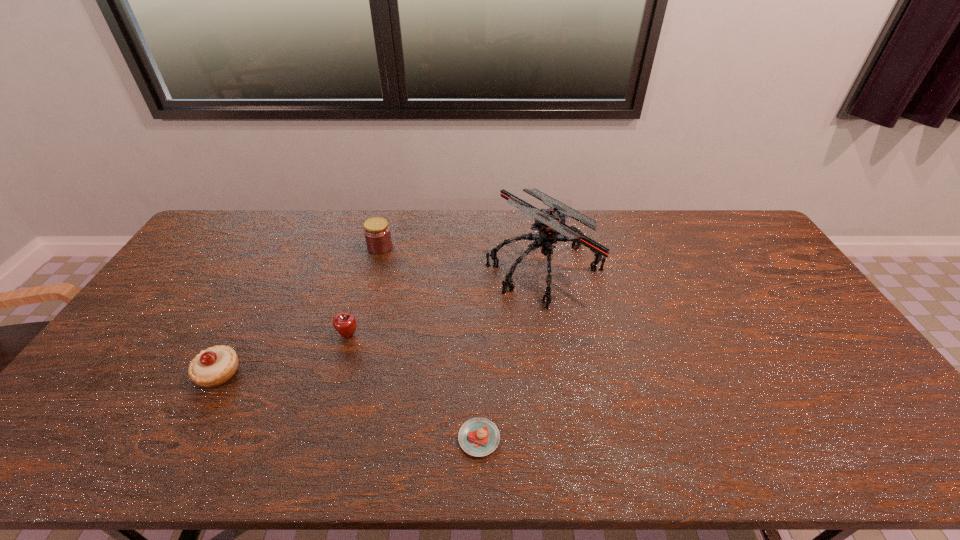
Find the location of a particular element. Image resolution: width=960 pixels, height=540 pixels. free region located on the right of the third nearest object is located at coordinates (418, 335).

Identify the location of vacant area situated on the left of the right pastry. This screenshot has height=540, width=960. (356, 438).

You are a GUI agent. You are given a task and a screenshot of the screen. Output one action in this format:
    pyautogui.click(x=<x>, y=<y>)
    Task: Click on the drone positioned at the far edge
    The width and height of the screenshot is (960, 540).
    Given the screenshot: What is the action you would take?
    pyautogui.click(x=550, y=223)

This screenshot has width=960, height=540. Identify the location of jam present at the far edge. (377, 233).

Locate an element on the screen. The image size is (960, 540). object situated at the near edge is located at coordinates (478, 437).

Where is `free point at the far edge`? This screenshot has width=960, height=540. free point at the far edge is located at coordinates (661, 219).

The image size is (960, 540). In order to click on vacant space at the near edge in this screenshot , I will do `click(142, 463)`.

In the image, there is a desktop. Where is `free space at the right edge`? free space at the right edge is located at coordinates (846, 371).

Where is `free location at the far left corner of the desktop`? The height and width of the screenshot is (540, 960). free location at the far left corner of the desktop is located at coordinates (263, 210).

What are the coordinates of `vacant region at the far right corner of the desktop` in the screenshot? It's located at coord(736,240).